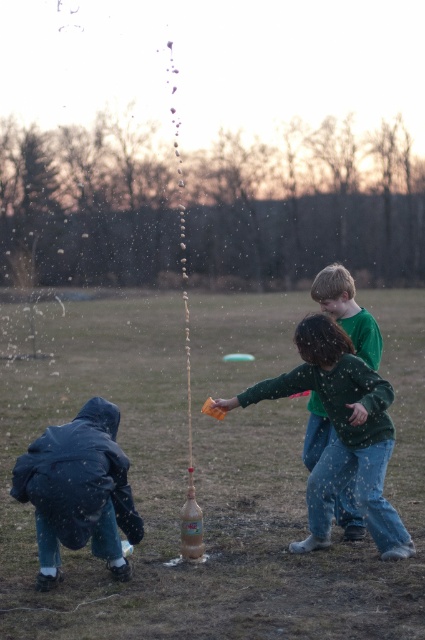
You are a photographer trying to capture both the green cotton shirt at center and the green matte shirt at center in a single shot. Since they are both at the center, which one should you focus on first to ensure both are in frame?

The green cotton shirt at center is to the left of green matte shirt at center, so focusing on the left side first would ensure both shirts are captured in the frame.

You are a parent supervising the children in the scene. You notice the brown matte bottle at center and the green matte shirt at center. Which object is bigger in size?

The brown matte bottle at center is larger in size compared to the green matte shirt at center.